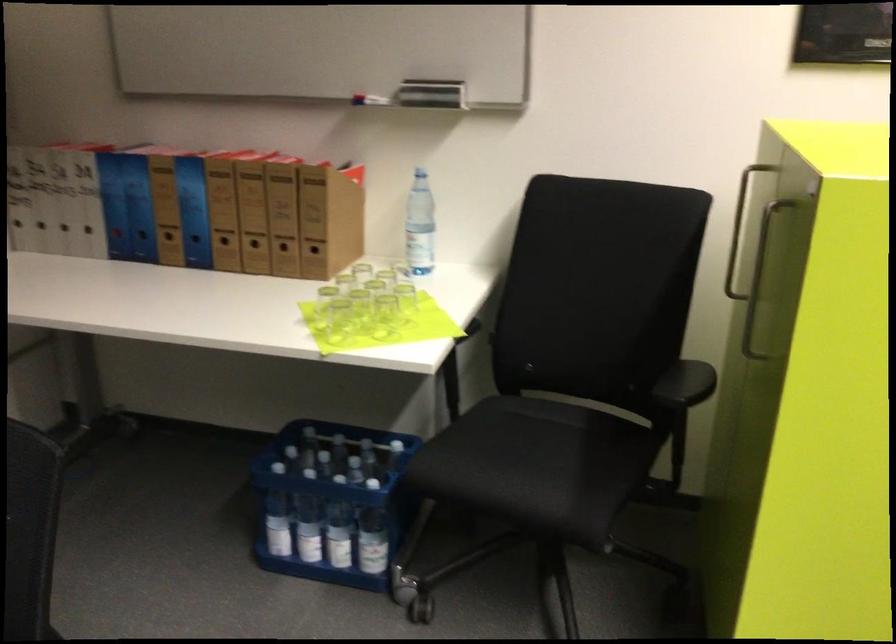
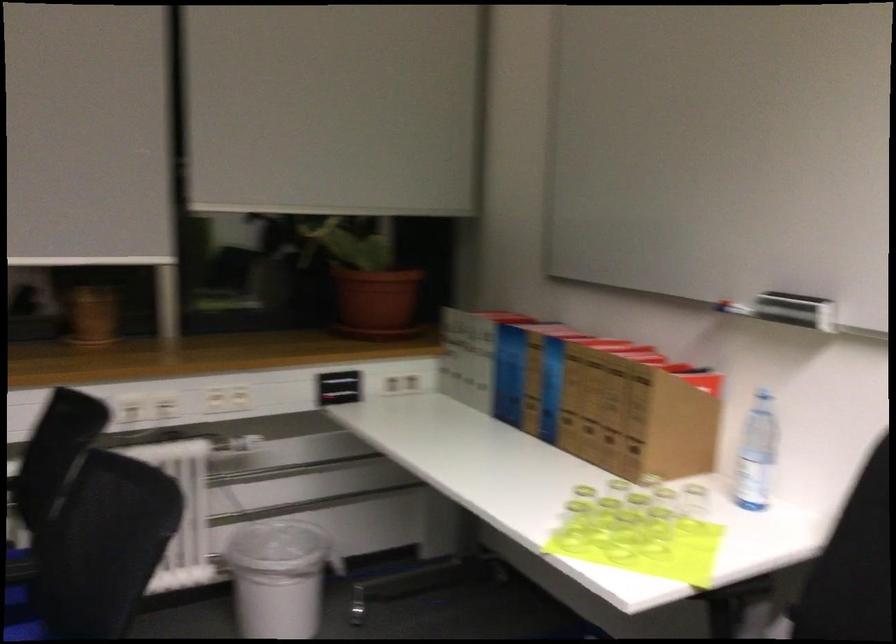
The point at (427, 93) is marked in the first image. Where is the corresponding point in the second image?

(795, 310)